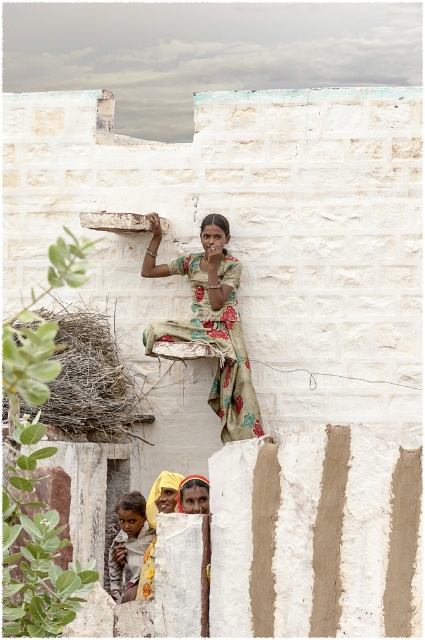
Question: Which point is closer to the camera?

Choices:
 (A) coord(124,493)
 (B) coord(189,253)

Answer: (A)

Question: Is floral cotton dress at center to the left of brown textured cloth at lower left from the viewer's perspective?

Choices:
 (A) yes
 (B) no

Answer: (B)

Question: From the image, what is the correct spatial relationship of floral cotton dress at center in relation to brown textured cloth at lower left?

Choices:
 (A) above
 (B) below

Answer: (A)

Question: Is floral cotton dress at center further to camera compared to brown textured cloth at lower left?

Choices:
 (A) no
 (B) yes

Answer: (B)

Question: Among these points, which one is nearest to the camera?

Choices:
 (A) pos(124,579)
 (B) pos(212,388)

Answer: (A)